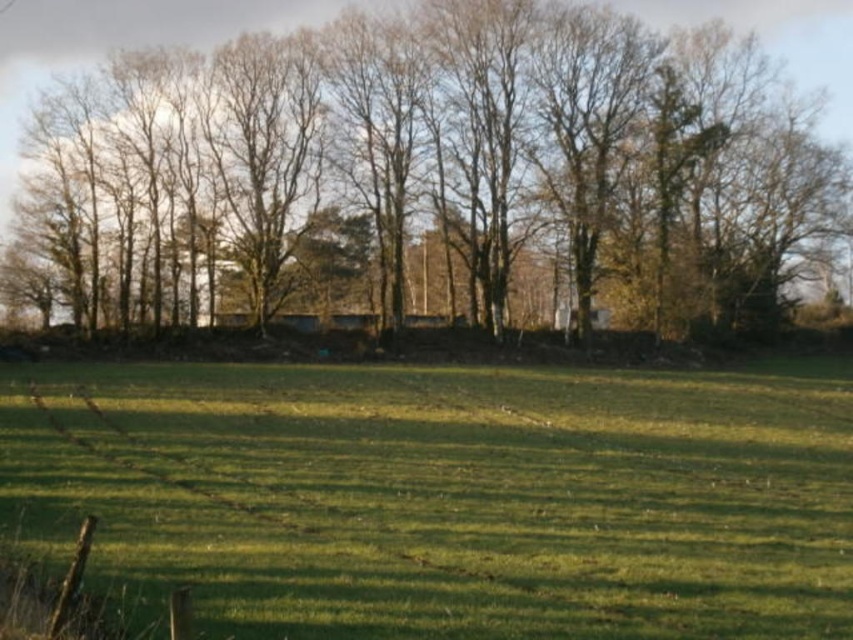
Is point (396, 506) positioned behind point (296, 17)?

No, (396, 506) is in front of (296, 17).

Which is more to the right, green grass at center or brown leafless trees at upper center?

brown leafless trees at upper center

Is point (334, 481) positioned behind point (189, 36)?

No, it is not.

Where is `green grass at center`? This screenshot has height=640, width=853. green grass at center is located at coordinates (450, 496).